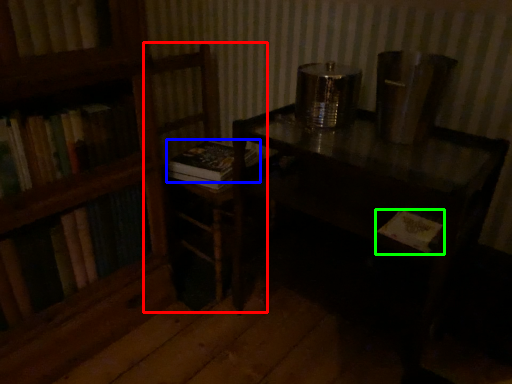
Question: Considering the real-world distances, which object is farthest from armchair (highlighted by a red box)? book (highlighted by a blue box) or book (highlighted by a green box)?

Choices:
 (A) book
 (B) book

Answer: (B)